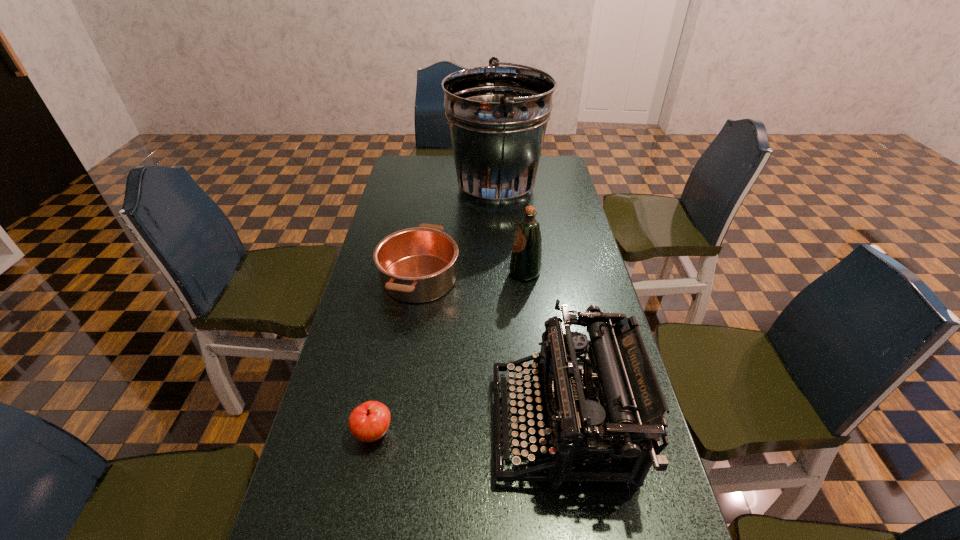
Locate an element on the screen. The height and width of the screenshot is (540, 960). free space located 0.210m on the typing side of the typewriter is located at coordinates (401, 424).

Where is `vacant space located 0.210m on the typing side of the typewriter`? The height and width of the screenshot is (540, 960). vacant space located 0.210m on the typing side of the typewriter is located at coordinates (401, 424).

Locate an element on the screen. free space located 0.320m on the typing side of the typewriter is located at coordinates (353, 424).

Where is `vacant space located on the right of the saucepan`? Image resolution: width=960 pixels, height=540 pixels. vacant space located on the right of the saucepan is located at coordinates (585, 279).

Identify the location of free space located 0.060m on the front of the apple. This screenshot has height=540, width=960. (364, 480).

The width and height of the screenshot is (960, 540). What are the coordinates of `object that is at the far edge` in the screenshot? It's located at (497, 115).

Identify the location of saucepan situated at the left edge. This screenshot has width=960, height=540. (416, 265).

Where is `apple that is at the left edge`? apple that is at the left edge is located at coordinates (368, 422).

You are a GUI agent. You are given a task and a screenshot of the screen. Output one action in this format:
    pyautogui.click(x=<x>, y=<y>)
    Task: Click on the bucket at the right edge
    
    Given the screenshot: What is the action you would take?
    pyautogui.click(x=497, y=115)

Where is `typewriter at the right edge`? Image resolution: width=960 pixels, height=540 pixels. typewriter at the right edge is located at coordinates (608, 405).